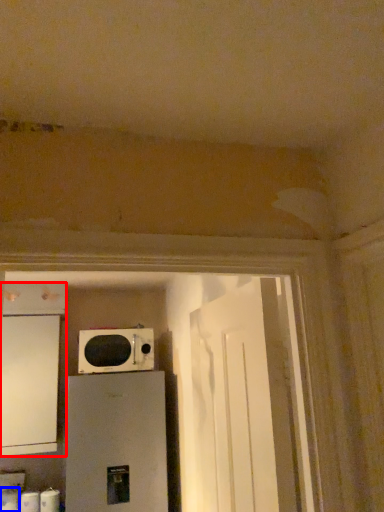
Question: Among these objects, which one is nearest to the camera, cabinetry (highlighted by a red box) or toilet paper (highlighted by a blue box)?

Choices:
 (A) cabinetry
 (B) toilet paper

Answer: (A)